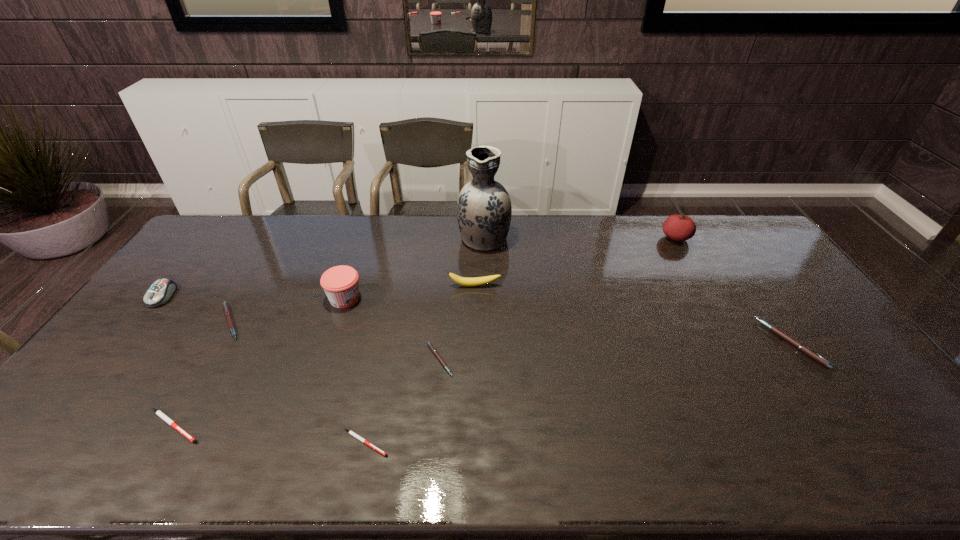
Where is `the rightmost pink pen`? This screenshot has height=540, width=960. the rightmost pink pen is located at coordinates (797, 344).

This screenshot has height=540, width=960. In order to click on the leftmost pink pen in this screenshot , I will do `click(227, 312)`.

Identify the location of the second biggest pink pen. (227, 312).

This screenshot has height=540, width=960. I want to click on the second pink pen from left to right, so click(x=429, y=344).

Where is `the fourth pen from left to right`? the fourth pen from left to right is located at coordinates (429, 344).

The height and width of the screenshot is (540, 960). In order to click on the bigger white pen in this screenshot , I will do `click(158, 412)`.

The image size is (960, 540). Find the location of `the third pen from right to left`. the third pen from right to left is located at coordinates (352, 433).

Where is `the shortest object`? The width and height of the screenshot is (960, 540). the shortest object is located at coordinates tap(352, 433).

Locate an element on the screen. Image resolution: width=960 pixels, height=540 pixels. free space located on the left of the tomato is located at coordinates (639, 238).

I want to click on free space located 0.130m on the front label of the jam, so click(x=403, y=299).